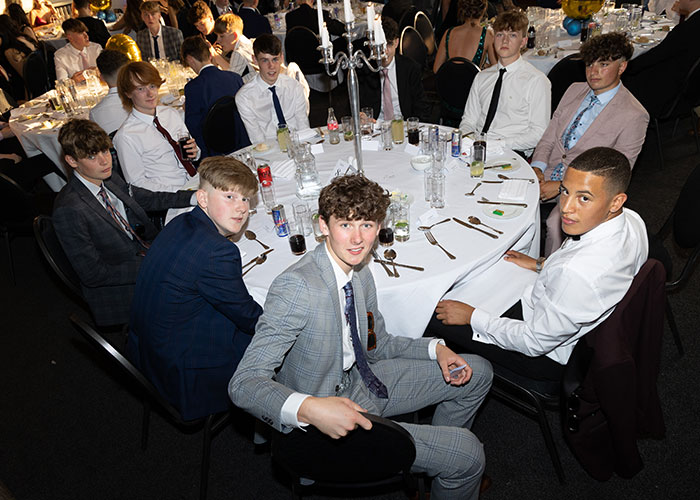
Locate an element on the screen. The height and width of the screenshot is (500, 700). table is located at coordinates (26, 127), (49, 30), (551, 35), (280, 26), (402, 170).